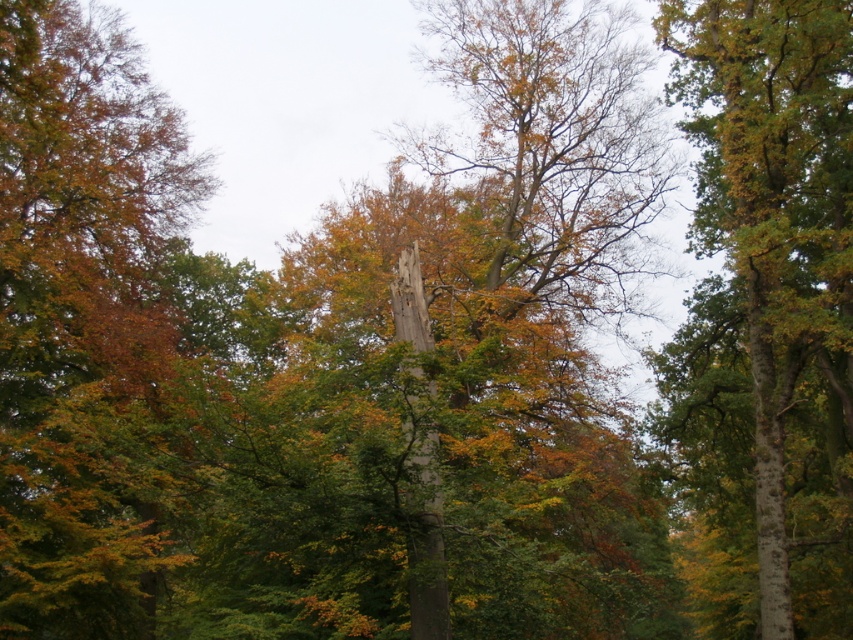
Question: Which object is positioned farthest from the green smooth bark tree at center?

Choices:
 (A) smooth gray totem pole at center
 (B) green leafy tree at left

Answer: (A)

Question: Based on their relative distances, which object is nearer to the green leafy tree at left?

Choices:
 (A) green smooth bark tree at center
 (B) smooth gray totem pole at center

Answer: (A)

Question: Can you confirm if green leafy tree at left is thinner than smooth gray totem pole at center?

Choices:
 (A) yes
 (B) no

Answer: (B)

Question: Is green leafy tree at left positioned at the back of smooth gray totem pole at center?

Choices:
 (A) yes
 (B) no

Answer: (B)

Question: Is green leafy tree at left smaller than smooth gray totem pole at center?

Choices:
 (A) yes
 (B) no

Answer: (B)

Question: Which point appears farthest from the camera in this image?

Choices:
 (A) (421, 378)
 (B) (683, 90)
 (C) (111, 257)

Answer: (C)